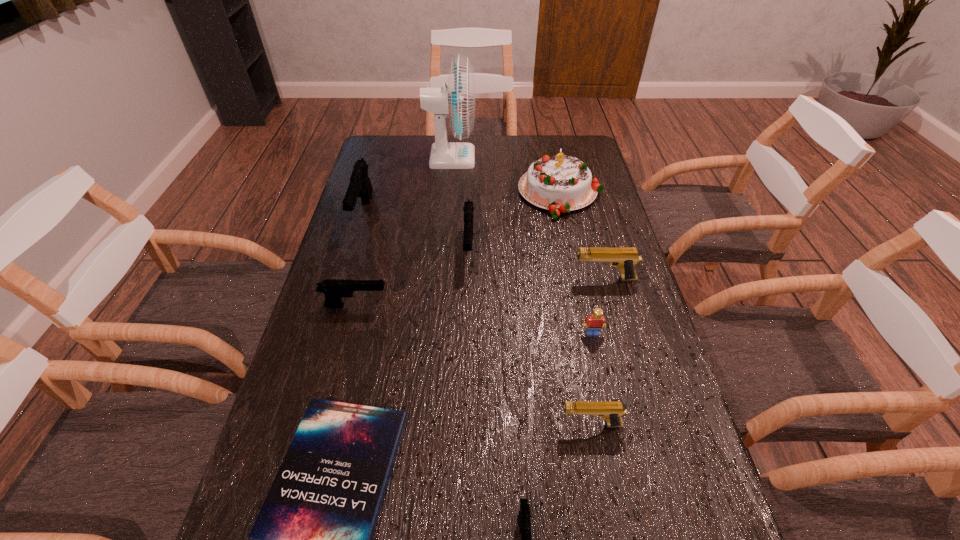
Where is `Lego`? Lego is located at coordinates (596, 321).

Find the location of a particular element. the smaller tan pistol is located at coordinates (612, 411).

Locate an element on the screen. the second nearest pistol is located at coordinates (612, 411).

Where is `vacant area located 0.190m in front of the white fan to face the airflow`? The image size is (960, 540). vacant area located 0.190m in front of the white fan to face the airflow is located at coordinates (525, 158).

Find the location of a particular element. The image size is (960, 540). vacant region located 0.150m on the back of the cake is located at coordinates (551, 148).

I want to click on free space located 0.180m on the front-facing side of the tallest pistol, so click(x=343, y=281).

What are the coordinates of `vacant region located on the front-facing side of the second biggest black pistol` in the screenshot? It's located at (465, 399).

What are the coordinates of `vacant position located 0.140m at the barrel of the fourth nearest pistol` in the screenshot? It's located at (523, 279).

This screenshot has width=960, height=540. I want to click on blank space located 0.150m at the barrel of the fourth nearest pistol, so click(x=520, y=279).

This screenshot has height=540, width=960. Identify the location of vacant space located 0.170m at the barrel of the fourth nearest pistol. (513, 279).